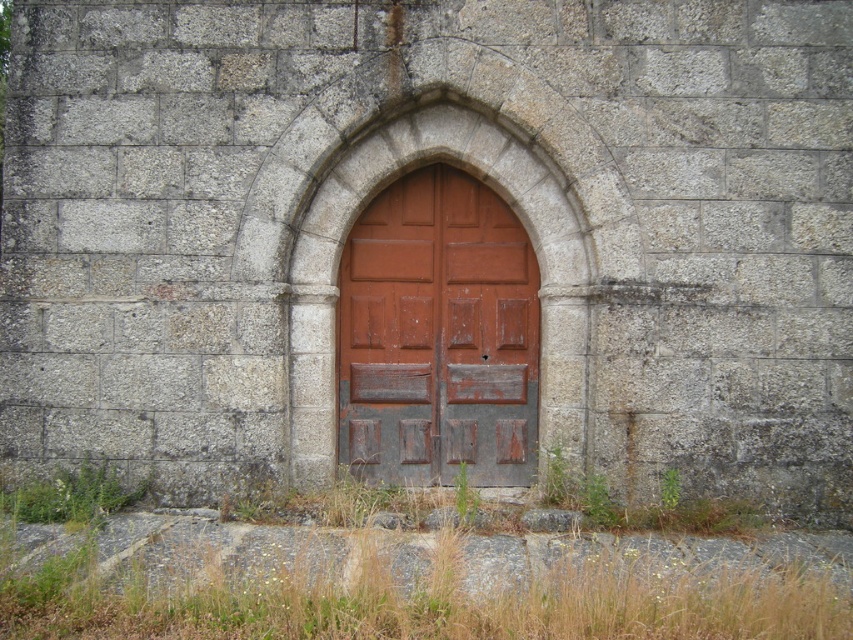
Question: Which object is positioned closest to the green grassy weed at lower left?

Choices:
 (A) green leafy weed at lower right
 (B) green grass at center

Answer: (B)

Question: Which point is farther to the camera?

Choices:
 (A) rustic wood door at center
 (B) green grass at center
 (C) green grassy weed at lower left
 (D) green leafy weed at lower right

Answer: (A)

Question: Can you confirm if green grassy weed at lower left is positioned below green leafy weed at lower right?

Choices:
 (A) no
 (B) yes

Answer: (B)

Question: Estimate the real-world distances between objects in this image. Which object is farther from the green leafy weed at lower right?

Choices:
 (A) green grass at center
 (B) green grassy weed at lower left

Answer: (B)

Question: Does green grass at center appear on the left side of green leafy weed at lower right?

Choices:
 (A) yes
 (B) no

Answer: (A)

Question: Is rustic wood door at center bigger than green leafy weed at lower right?

Choices:
 (A) yes
 (B) no

Answer: (A)